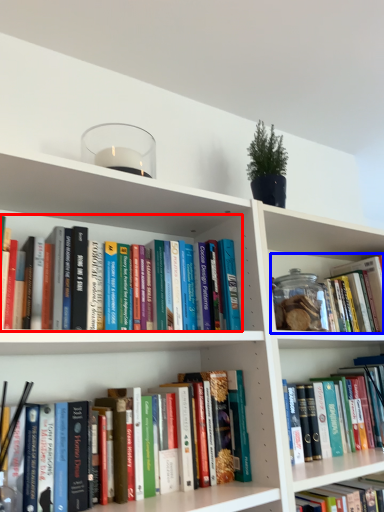
Question: Which object appears closest to the camera in this image, book (highlighted by a red box) or book (highlighted by a blue box)?

Choices:
 (A) book
 (B) book

Answer: (A)